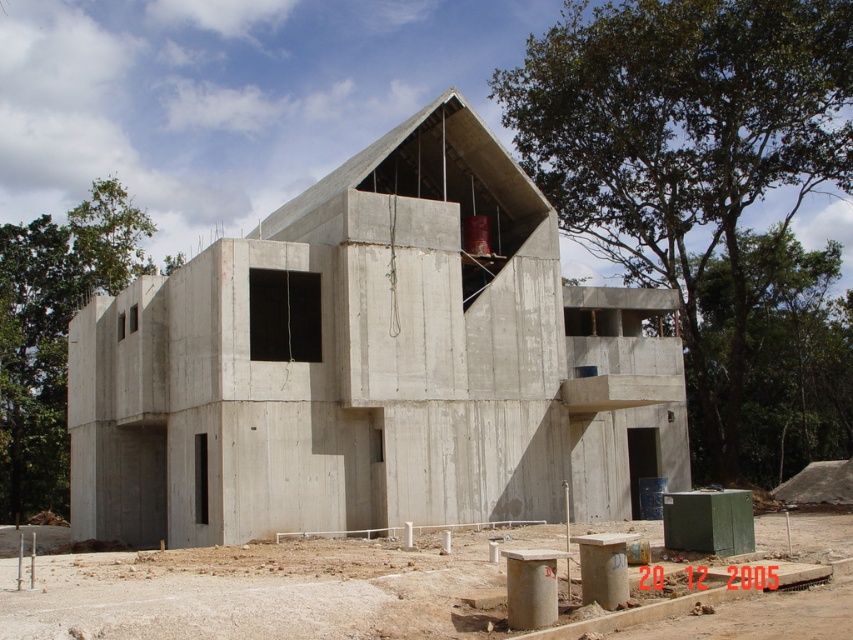
Question: Among these objects, which one is farthest from the camera?

Choices:
 (A) concrete at center
 (B) concrete building at center

Answer: (B)

Question: Does concrete building at center have a smaller size compared to concrete at center?

Choices:
 (A) yes
 (B) no

Answer: (B)

Question: Is concrete building at center closer to camera compared to concrete at center?

Choices:
 (A) no
 (B) yes

Answer: (A)

Question: Can you confirm if concrete building at center is positioned above concrete at center?

Choices:
 (A) no
 (B) yes

Answer: (B)

Question: Which of the following is the closest to the observer?

Choices:
 (A) (392, 141)
 (B) (683, 589)

Answer: (B)